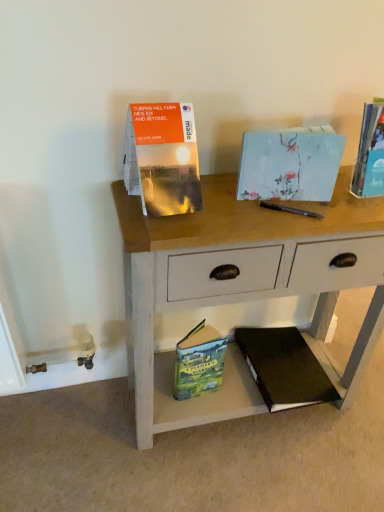
This screenshot has height=512, width=384. In order to click on free region on the left part of hardcover book at upper right, the 5th paperback book when ordered from bottom to top in this screenshot , I will do `click(322, 203)`.